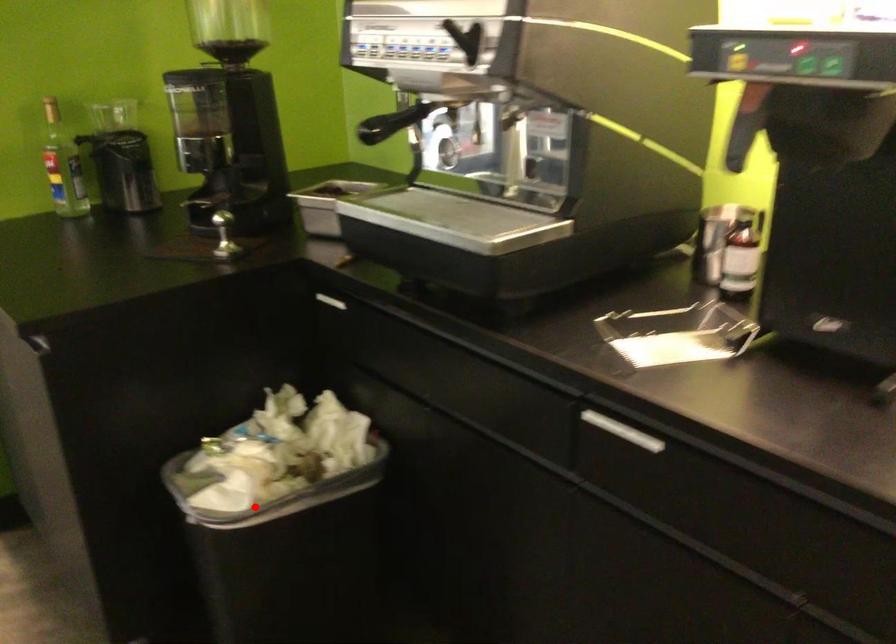
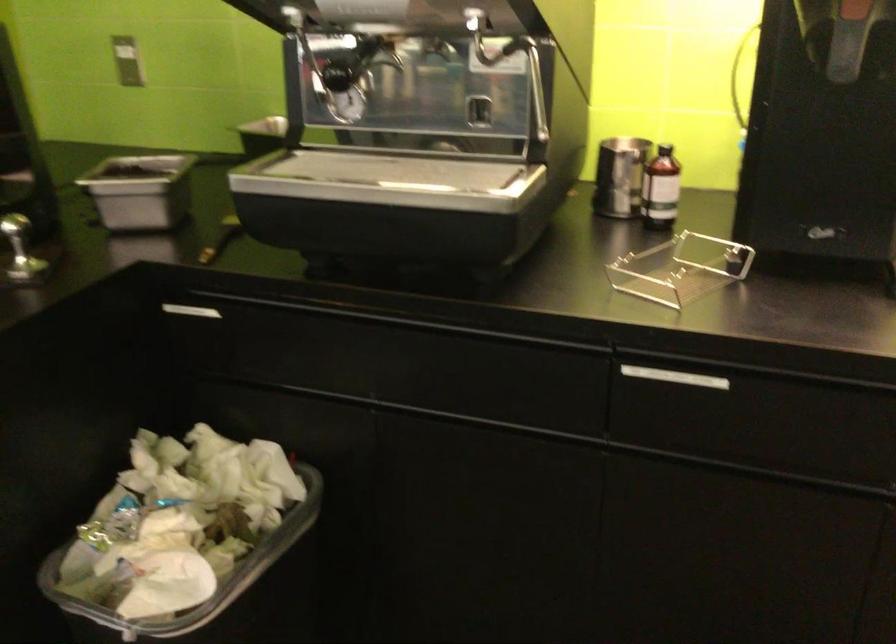
Question: I am providing you with two images of the same scene from different viewpoints. A red point is shown in image1. For the corresponding object point in image2, is it positioned nearer or farther from the camera?

Choices:
 (A) Nearer
 (B) Farther

Answer: (A)